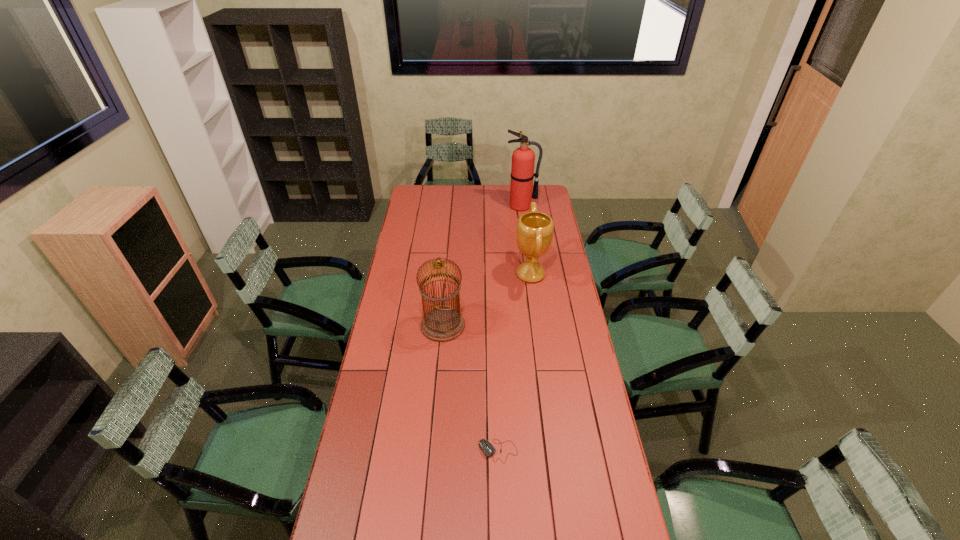
Find the location of a particular element. The width and height of the screenshot is (960, 540). free space at the far left corner of the desktop is located at coordinates (416, 195).

Where is `empty location between the fire extinguisher and the shortest object`? This screenshot has height=540, width=960. empty location between the fire extinguisher and the shortest object is located at coordinates (510, 328).

Identify the location of vacant area between the third nearest object and the second object from left to right. (515, 363).

Identify the location of vacant area that lies between the tallest object and the computer mouse. (510, 328).

Locate an element on the screen. The image size is (960, 540). vacant space in between the leftmost object and the computer mouse is located at coordinates (470, 388).

The height and width of the screenshot is (540, 960). What are the coordinates of `object that is the closest to the second farthest object` in the screenshot? It's located at (442, 324).

In order to click on the second closest object relative to the birdcage in this screenshot , I will do `click(488, 449)`.

I want to click on vacant space that satisfies the following two spatial constraints: 1. on the front-facing side of the shortest object; 2. on the left side of the leftmost object, so click(x=432, y=451).

Where is `free spot that satisfies the following two spatial constraints: 1. on the front of the award with the decoration; 2. on the front side of the computer mouse`? This screenshot has width=960, height=540. free spot that satisfies the following two spatial constraints: 1. on the front of the award with the decoration; 2. on the front side of the computer mouse is located at coordinates (554, 451).

Where is `free space that satisfies the following two spatial constraints: 1. at the nozzle of the farthest object; 2. on the front-facing side of the leftmost object`? The width and height of the screenshot is (960, 540). free space that satisfies the following two spatial constraints: 1. at the nozzle of the farthest object; 2. on the front-facing side of the leftmost object is located at coordinates (537, 326).